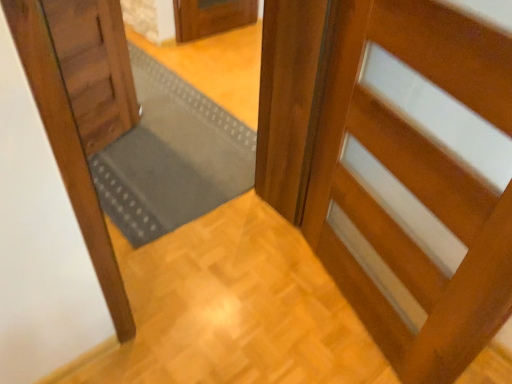
At what (x,y) coordinates should I click in order to perform the action: click on unoccupied space behind wooden door at left, positioned as the second door in right-to-left order. Please return your answer as a coordinate pair (x, y). Image resolution: width=512 pixels, height=384 pixels. Looking at the image, I should click on (161, 114).